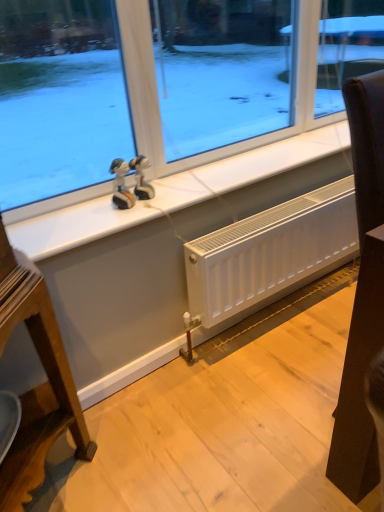
Question: From their relative heights in the image, would you say glossy plastic figurine at upper center, marked as the second figurine in a left-to-right arrangement, is taller or shorter than white tile at upper center?

Choices:
 (A) short
 (B) tall

Answer: (B)

Question: Considering the positions of point (134, 192) and point (261, 164), is point (134, 192) closer or farther from the camera than point (261, 164)?

Choices:
 (A) farther
 (B) closer

Answer: (B)

Question: Estimate the real-world distances between objects in this image. Which object is farther from the black leather chair at right?

Choices:
 (A) white tile at upper center
 (B) matte plastic figurine at center, which ranks as the 1th figurine in left-to-right order
 (C) glossy plastic figurine at upper center, which is counted as the first figurine, starting from the right
 (D) white matte radiator at lower center

Answer: (B)

Question: Considering the real-world distances, which object is closest to the black leather chair at right?

Choices:
 (A) matte plastic figurine at center, the second figurine from the right
 (B) white tile at upper center
 (C) white matte radiator at lower center
 (D) glossy plastic figurine at upper center, which is counted as the first figurine, starting from the right

Answer: (C)